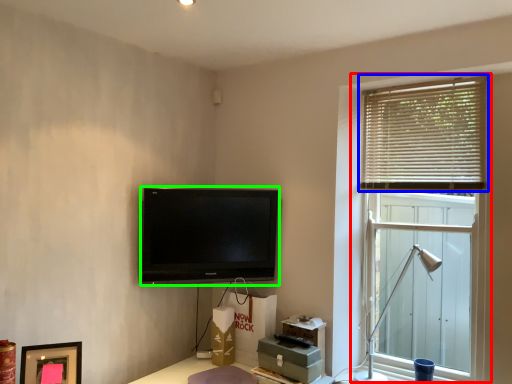
Question: Based on their relative distances, which object is nearer to window (highlighted by a red box)? Choose from window blind (highlighted by a blue box) and television (highlighted by a green box).

Choices:
 (A) window blind
 (B) television

Answer: (A)